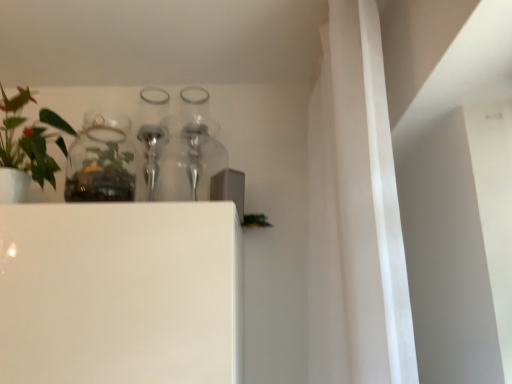
Question: Is clear glass jar at upper left aimed at green matte plant at left?

Choices:
 (A) no
 (B) yes

Answer: (A)

Question: Is clear glass jar at upper left to the right of green matte plant at left from the viewer's perspective?

Choices:
 (A) no
 (B) yes

Answer: (B)

Question: Can you confirm if clear glass jar at upper left is wider than green matte plant at left?

Choices:
 (A) no
 (B) yes

Answer: (A)

Question: Is clear glass jar at upper left oriented away from green matte plant at left?

Choices:
 (A) yes
 (B) no

Answer: (B)

Question: Is clear glass jar at upper left smaller than green matte plant at left?

Choices:
 (A) yes
 (B) no

Answer: (A)

Question: Considering the positions of point (35, 173) and point (98, 117), is point (35, 173) closer or farther from the camera than point (98, 117)?

Choices:
 (A) farther
 (B) closer

Answer: (B)

Question: Relative to clear glass jar at upper left, is green matte plant at left in front or behind?

Choices:
 (A) front
 (B) behind

Answer: (A)

Question: From the image's perspective, is green matte plant at left above or below clear glass jar at upper left?

Choices:
 (A) above
 (B) below

Answer: (A)

Question: In terms of size, does green matte plant at left appear bigger or smaller than clear glass jar at upper left?

Choices:
 (A) small
 (B) big

Answer: (B)

Question: Would you say clear glass jar at upper left is to the left or to the right of clear glass bottle at upper center in the picture?

Choices:
 (A) left
 (B) right

Answer: (A)

Question: Considering the positions of point (84, 135) and point (152, 196), is point (84, 135) closer or farther from the camera than point (152, 196)?

Choices:
 (A) farther
 (B) closer

Answer: (B)

Question: From the image's perspective, is clear glass jar at upper left above or below clear glass bottle at upper center?

Choices:
 (A) above
 (B) below

Answer: (B)

Question: Is clear glass jar at upper left situated inside clear glass bottle at upper center or outside?

Choices:
 (A) outside
 (B) inside

Answer: (A)

Question: In the image, is green matte plant at left positioned in front of or behind clear glass bottle at upper center?

Choices:
 (A) front
 (B) behind

Answer: (A)

Question: Looking at their shapes, would you say green matte plant at left is wider or thinner than clear glass bottle at upper center?

Choices:
 (A) wide
 (B) thin

Answer: (A)